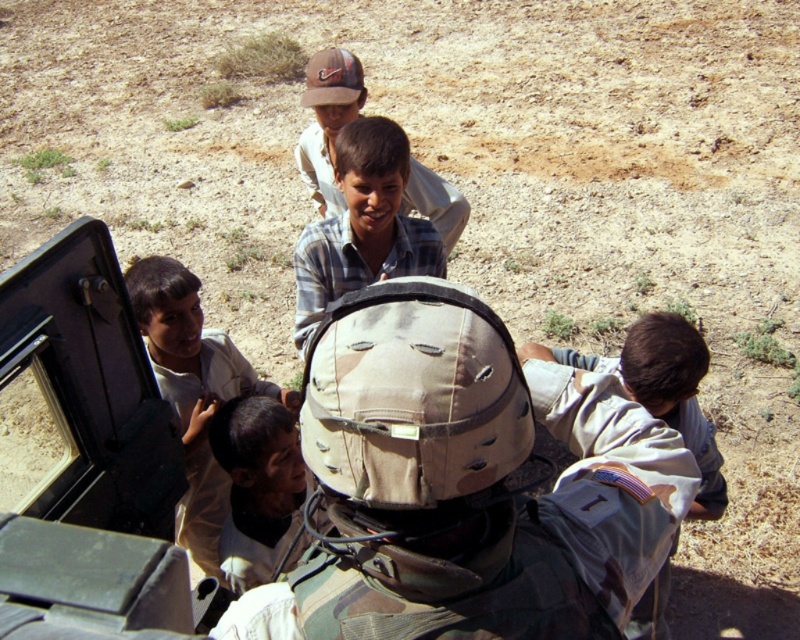
Can you confirm if light brown skin at center is smaller than light brown uniform at center?

No.

Can you confirm if light brown skin at center is shorter than light brown uniform at center?

In fact, light brown skin at center may be taller than light brown uniform at center.

Locate an element on the screen. The height and width of the screenshot is (640, 800). light brown skin at center is located at coordinates (193, 392).

Who is taller, camouflage helmet at center or plaid shirt at center?

plaid shirt at center is taller.

Does point (438, 349) come in front of point (358, 92)?

Yes, it is.

Describe the element at coordinates (472, 480) in the screenshot. I see `camouflage helmet at center` at that location.

Identify the location of camouflage helmet at center. (472, 480).

Can you confirm if light brown uniform at center is thinner than plaid shirt at center?

Yes.

Find the location of a particular element. This screenshot has height=640, width=800. light brown uniform at center is located at coordinates (260, 490).